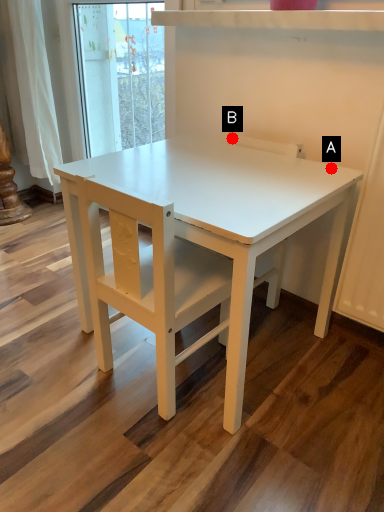
Question: Two points are circled on the image, labeled by A and B beside each circle. Which point appears closest to the camera in this image?

Choices:
 (A) A is closer
 (B) B is closer

Answer: (A)